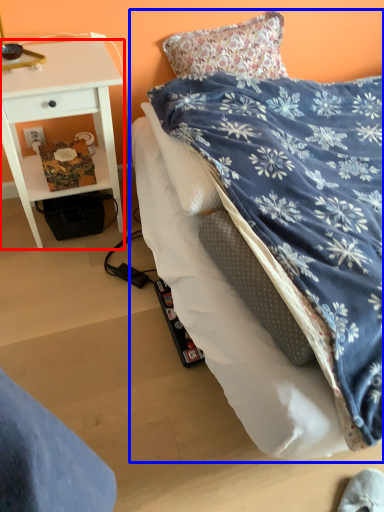
Question: Which object is further to the camera taking this photo, desk (highlighted by a red box) or bed (highlighted by a blue box)?

Choices:
 (A) desk
 (B) bed

Answer: (A)